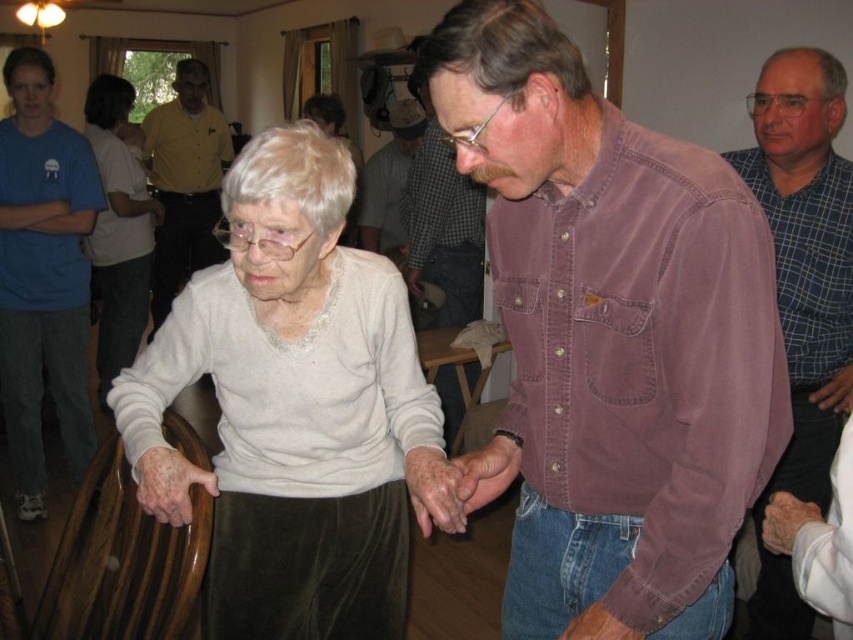
Question: Based on their relative distances, which object is nearer to the matte brown shirt at center?

Choices:
 (A) blue cotton shirt at left
 (B) light beige sweater at center
 (C) brown corduroy shirt at center

Answer: (B)

Question: Does checkered fabric shirt at upper right lie in front of yellow shirt at center?

Choices:
 (A) no
 (B) yes

Answer: (B)

Question: Which of the following is the farthest from the observer?

Choices:
 (A) matte brown shirt at center
 (B) plaid shirt at center

Answer: (B)

Question: Is light beige sweater at center in front of white matte sweater at upper left?

Choices:
 (A) yes
 (B) no

Answer: (A)

Question: Is light beige sweater at center positioned in front of blue cotton shirt at left?

Choices:
 (A) yes
 (B) no

Answer: (A)

Question: Estimate the real-world distances between objects in this image. Which object is closer to the yellow shirt at center?

Choices:
 (A) matte brown shirt at center
 (B) plaid shirt at center
 (C) brown corduroy shirt at center
 (D) light beige sweater at center

Answer: (B)